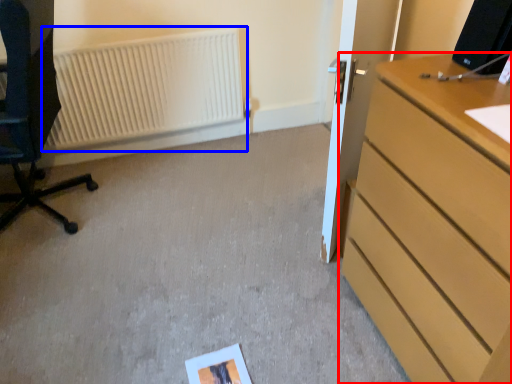
Question: Which object is closer to the camera taking this photo, chest of drawers (highlighted by a red box) or radiator (highlighted by a blue box)?

Choices:
 (A) chest of drawers
 (B) radiator

Answer: (A)